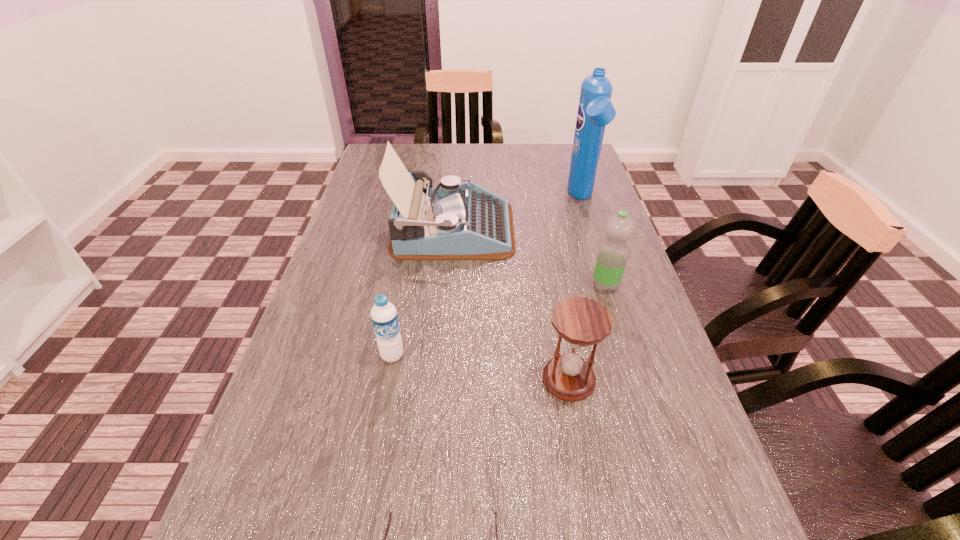
Identify the location of the tallest object. The height and width of the screenshot is (540, 960). (595, 110).

Identify the location of typewriter. tap(454, 221).

The width and height of the screenshot is (960, 540). Identify the location of the right water bottle. (612, 256).

The height and width of the screenshot is (540, 960). Find the location of `the fourth nearest object`. the fourth nearest object is located at coordinates (612, 256).

The height and width of the screenshot is (540, 960). I want to click on hourglass, so click(581, 321).

Find the location of a particular element. Image resolution: width=960 pixels, height=540 pixels. the nearer water bottle is located at coordinates (384, 317).

Find the location of a particular element. The height and width of the screenshot is (540, 960). the left water bottle is located at coordinates (384, 317).

The image size is (960, 540). I want to click on vacant area situated 0.110m on the left of the tallest object, so click(x=532, y=198).

You are a GUI agent. You are given a task and a screenshot of the screen. Output one action in this format:
    pyautogui.click(x=<x>, y=<y>)
    Task: Click on the vacant area situated 0.060m on the typing side of the typewriter
    This screenshot has width=960, height=540.
    Given the screenshot: What is the action you would take?
    pyautogui.click(x=536, y=229)

Where is `vacant space located 0.390m on the left of the taller water bottle`? vacant space located 0.390m on the left of the taller water bottle is located at coordinates (428, 285).